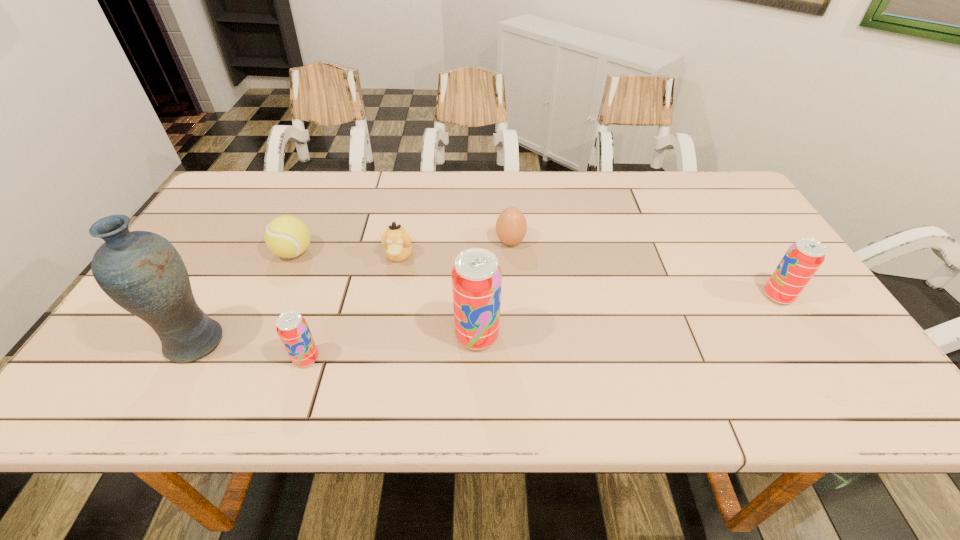
You are a GUI agent. You are given a task and a screenshot of the screen. Output one action in this format:
    pyautogui.click(x=<x>, y=<y>)
    Task: Click on the vacant space in between the tallest soda can and the fifth object from right to left
    
    Given the screenshot: What is the action you would take?
    pyautogui.click(x=392, y=347)

Find the location of a particular element. The image size is (960, 540). free area in between the tallest object and the boiled egg is located at coordinates (352, 293).

You are a GUI agent. You are given a task and a screenshot of the screen. Output one action in this format:
    pyautogui.click(x=<x>, y=<y>)
    Task: Click on the unoccupied position between the leftmost soda can and the fourth object from right to left
    Image resolution: width=960 pixels, height=540 pixels.
    Given the screenshot: What is the action you would take?
    pyautogui.click(x=352, y=307)

Image resolution: width=960 pixels, height=540 pixels. I want to click on empty location between the tallest soda can and the second object from left to right, so click(x=386, y=294).

Locate an element on the screen. object that is the sixth nearest to the leftmost soda can is located at coordinates (803, 258).

Locate which object is the fourth closest to the sixth shortest object. Please provide its 2D coordinates. Your answer should be formatted as a tuple, i.e. [(x, y)], where the tuple contains the x and y coordinates of a point satisfying the conditions above.

[(286, 236)]

At what (x,y) coordinates should I click in order to perform the action: click on the third closest soda can to the second object from left to right. Please return your answer as a coordinate pair (x, y). This screenshot has width=960, height=540. Looking at the image, I should click on (803, 258).

Identify which soda can is the second nearest to the third object from left to right. Please provide its 2D coordinates. Your answer should be formatted as a tuple, i.e. [(x, y)], where the tuple contains the x and y coordinates of a point satisfying the conditions above.

[(803, 258)]

Identify the location of vacant region that satisfies the following two spatial constraints: 1. on the face of the sixth shortest object; 2. on the left side of the duckling. (384, 336).

You are a GUI agent. You are given a task and a screenshot of the screen. Output one action in this format:
    pyautogui.click(x=<x>, y=<y>)
    Task: Click on the free point that satisfies the following two spatial constraints: 1. on the front side of the vase; 2. on the left side of the fifth object from right to left
    
    Given the screenshot: What is the action you would take?
    pyautogui.click(x=186, y=359)